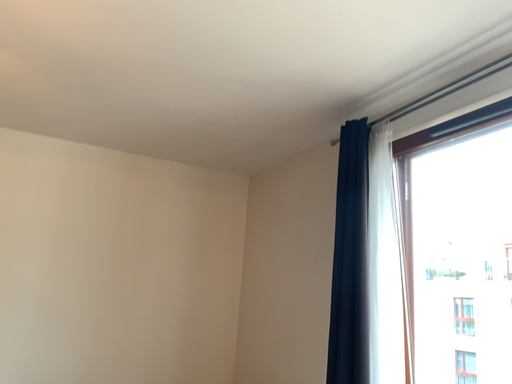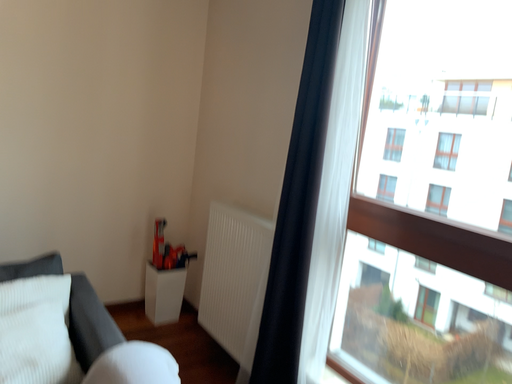
Question: Which way did the camera rotate in the video?

Choices:
 (A) rotated upward
 (B) rotated downward

Answer: (B)